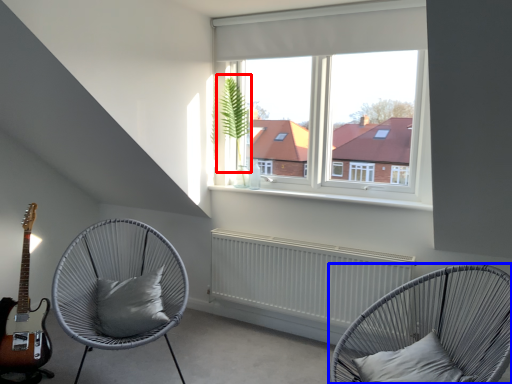
Question: Which point is closer to the camera, plant (highlighted by a red box) or chair (highlighted by a blue box)?

Choices:
 (A) plant
 (B) chair

Answer: (B)